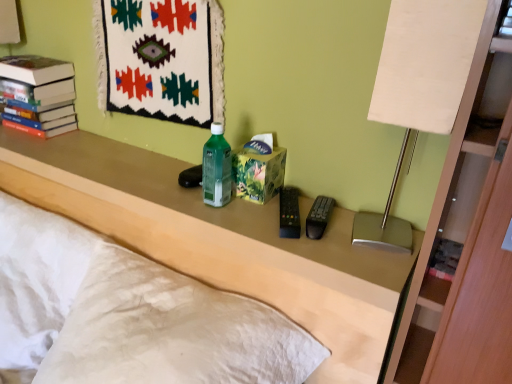
The width and height of the screenshot is (512, 384). What are the coordinates of `matte plastic remote control at center` in the screenshot? It's located at (220, 241).

I want to click on white textured pillow at lower left, so click(36, 281).

Locate an element on the screen. This screenshot has height=384, width=512. hardcover books at upper left is located at coordinates (38, 95).

The width and height of the screenshot is (512, 384). What are the coordinates of `furniture below the hardcover books at upper left (from the image's perspective)` in the screenshot? It's located at (220, 241).

Is the surface of matte plastic remote control at center in direct contact with hardcover books at upper left?

No.

Considering the sizes of objects matte plastic remote control at center and hardcover books at upper left in the image provided, who is thinner, matte plastic remote control at center or hardcover books at upper left?

hardcover books at upper left.

Is matte plastic remote control at center positioned in front of hardcover books at upper left?

Yes, matte plastic remote control at center is closer to the viewer.

Based on the photo, is matte beige table lamp at right looking in the opposite direction of white textured pillow at lower left?

No, matte beige table lamp at right is not facing away from white textured pillow at lower left.

Measure the distance from matte beige table lamp at right to white textured pillow at lower left.

They are 87.39 centimeters apart.

From the image's perspective, which one is positioned higher, matte beige table lamp at right or white textured pillow at lower left?

matte beige table lamp at right, from the image's perspective.

Is matte beige table lamp at right placed right next to white textured pillow at lower left?

matte beige table lamp at right is not next to white textured pillow at lower left, and they're not touching.

From the image's perspective, between white textured pillow at lower left and matte plastic remote control at center, who is located below?

white textured pillow at lower left appears lower in the image.

In the scene shown: Does white textured pillow at lower left appear on the left side of matte plastic remote control at center?

Indeed, white textured pillow at lower left is positioned on the left side of matte plastic remote control at center.

Between white textured pillow at lower left and matte plastic remote control at center, which one has more height?

matte plastic remote control at center.

Is hardcover books at upper left facing towards white textured pillow at lower left?

No, hardcover books at upper left does not turn towards white textured pillow at lower left.

Based on the photo, from the image's perspective, is hardcover books at upper left positioned above or below white textured pillow at lower left?

Based on their image positions, hardcover books at upper left is located above white textured pillow at lower left.

Is the depth of hardcover books at upper left greater than that of white textured pillow at lower left?

Yes, it is behind white textured pillow at lower left.

Is matte plastic remote control at center aimed at white textured pillow at lower left?

Yes, matte plastic remote control at center is aimed at white textured pillow at lower left.

From the image's perspective, which is below, matte plastic remote control at center or white textured pillow at lower left?

white textured pillow at lower left appears lower in the image.

From a real-world perspective, is matte plastic remote control at center positioned above or below white textured pillow at lower left?

Clearly, from a real-world perspective, matte plastic remote control at center is above white textured pillow at lower left.

Which object is wider, matte plastic remote control at center or white textured pillow at lower left?

white textured pillow at lower left is wider.

Is matte plastic remote control at center turned away from matte beige table lamp at right?

matte plastic remote control at center does not have its back to matte beige table lamp at right.

From the picture: Who is smaller, matte plastic remote control at center or matte beige table lamp at right?

matte beige table lamp at right is smaller.

How different are the orientations of matte plastic remote control at center and matte beige table lamp at right in degrees?

4.57 degrees separate the facing orientations of matte plastic remote control at center and matte beige table lamp at right.

Is hardcover books at upper left facing away from matte plastic remote control at center?

No, hardcover books at upper left's orientation is not away from matte plastic remote control at center.

Is hardcover books at upper left directly adjacent to matte plastic remote control at center?

No, hardcover books at upper left is not next to matte plastic remote control at center.

Is point (60, 110) behind point (161, 206)?

Yes, it is.

From the picture: From the image's perspective, is hardcover books at upper left positioned above or below matte plastic remote control at center?

hardcover books at upper left is situated higher than matte plastic remote control at center in the image.

The image size is (512, 384). Identify the location of furniture on the right of hardcover books at upper left. (220, 241).

You are a GUI agent. You are given a task and a screenshot of the screen. Output one action in this format:
    pyautogui.click(x=<x>, y=<y>)
    Task: Click on the table lamp in front of the white textured pillow at lower left
    The height and width of the screenshot is (384, 512).
    Given the screenshot: What is the action you would take?
    pyautogui.click(x=419, y=88)

When comparing their distances from hardcover books at upper left, does white textured pillow at lower left or matte plastic remote control at center seem closer?

matte plastic remote control at center lies closer to hardcover books at upper left than the other object.

Based on their spatial positions, is matte beige table lamp at right or white textured pillow at lower left further from matte plastic remote control at center?

matte beige table lamp at right.

From the picture: Based on their spatial positions, is hardcover books at upper left or white textured pillow at lower left closer to matte plastic remote control at center?

white textured pillow at lower left.

In the scene shown: Considering their positions, is matte plastic remote control at center positioned closer to hardcover books at upper left than matte beige table lamp at right?

Among the two, matte plastic remote control at center is located nearer to hardcover books at upper left.

Estimate the real-world distances between objects in this image. Which object is further from white textured pillow at lower left, hardcover books at upper left or matte beige table lamp at right?

Among the two, matte beige table lamp at right is located further to white textured pillow at lower left.

When comparing their distances from matte plastic remote control at center, does white textured pillow at lower left or hardcover books at upper left seem closer?

white textured pillow at lower left is positioned closer to the anchor matte plastic remote control at center.

Based on their spatial positions, is white textured pillow at lower left or hardcover books at upper left further from matte beige table lamp at right?

hardcover books at upper left.

In the scene shown: Estimate the real-world distances between objects in this image. Which object is further from matte beige table lamp at right, hardcover books at upper left or white textured pillow at lower left?

The object further to matte beige table lamp at right is hardcover books at upper left.

This screenshot has height=384, width=512. I want to click on furniture between white textured pillow at lower left and matte beige table lamp at right from left to right, so click(x=220, y=241).

Locate an element on the screen. furniture between hardcover books at upper left and white textured pillow at lower left in the up-down direction is located at coordinates (220, 241).

Where is `furniture between hardcover books at upper left and matte beige table lamp at right in the horizontal direction`? furniture between hardcover books at upper left and matte beige table lamp at right in the horizontal direction is located at coordinates (220, 241).

At what (x,y) coordinates should I click in order to perform the action: click on book located between white textured pillow at lower left and matte beige table lamp at right in the left-right direction. Please return your answer as a coordinate pair (x, y). The image size is (512, 384). Looking at the image, I should click on (38, 95).